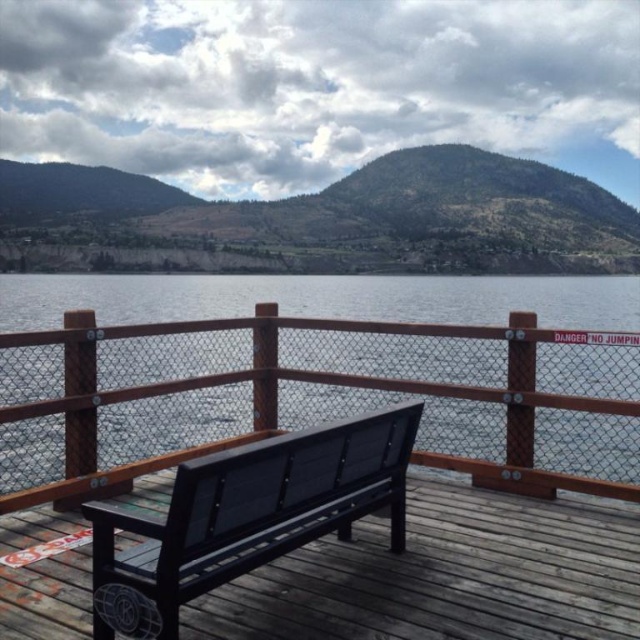
Question: Does transparent glass water at center have a larger size compared to matte black bench at center?

Choices:
 (A) no
 (B) yes

Answer: (B)

Question: Is the position of transparent glass water at center more distant than that of matte black bench at center?

Choices:
 (A) yes
 (B) no

Answer: (A)

Question: Which point is closer to the camera?

Choices:
 (A) (397, 284)
 (B) (134, 582)

Answer: (B)

Question: Which point is closer to the camera?

Choices:
 (A) matte black bench at center
 (B) transparent glass water at center

Answer: (A)

Question: Is transparent glass water at center smaller than matte black bench at center?

Choices:
 (A) no
 (B) yes

Answer: (A)